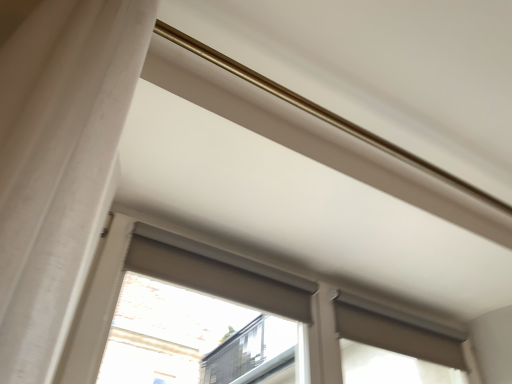
Question: Choose the correct answer: Is matte gray roller shade at upper center inside matte gray roller blind at upper right, which is counted as the 2th window, starting from the top, or outside it?

Choices:
 (A) outside
 (B) inside

Answer: (A)

Question: Based on their sizes in the image, would you say matte gray roller shade at upper center is bigger or smaller than matte gray roller blind at upper right, which appears as the first window when ordered from the bottom?

Choices:
 (A) big
 (B) small

Answer: (B)

Question: Considering the real-world distances, which object is closest to the matte gray roller blind at center, which is the second window in bottom-to-top order?

Choices:
 (A) matte gray roller shade at upper center
 (B) matte gray roller blind at upper right, which is counted as the 2th window, starting from the top

Answer: (B)

Question: Based on their relative distances, which object is nearer to the matte gray roller blind at upper right, which is counted as the 2th window, starting from the top?

Choices:
 (A) matte gray roller shade at upper center
 (B) matte gray roller blind at center, which is the second window in bottom-to-top order

Answer: (B)